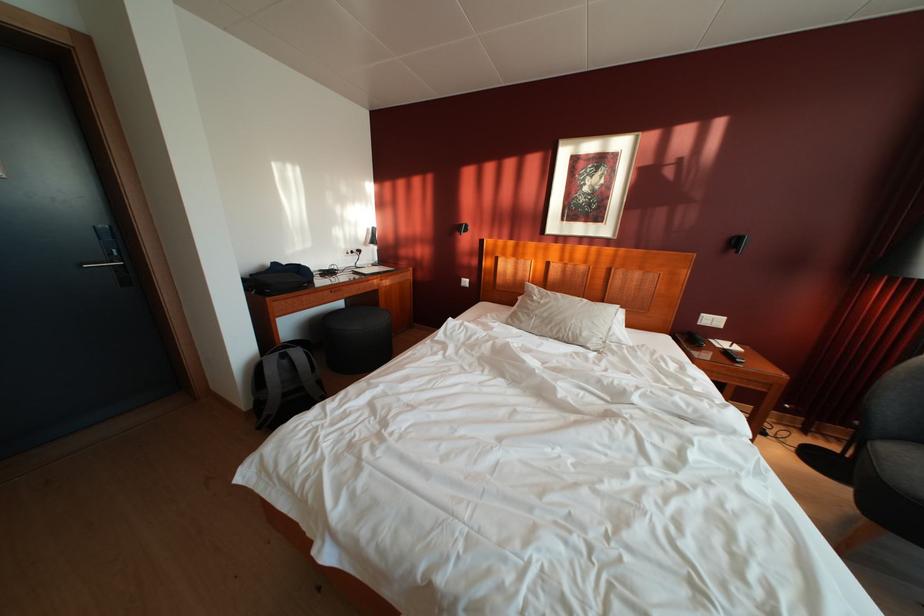
You are a GUI agent. You are given a task and a screenshot of the screen. Output one action in this format:
    pyautogui.click(x=<x>, y=<y>)
    Task: Click on the silver door handle
    The image size is (924, 616).
    Given the screenshot: What is the action you would take?
    pyautogui.click(x=108, y=262)